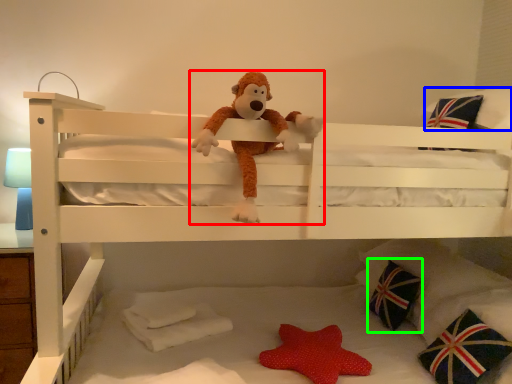
Question: Estimate the real-world distances between objects in this image. Which object is farther from toy (highlighted by a red box), pillow (highlighted by a blue box) or pillow (highlighted by a green box)?

Choices:
 (A) pillow
 (B) pillow

Answer: (B)